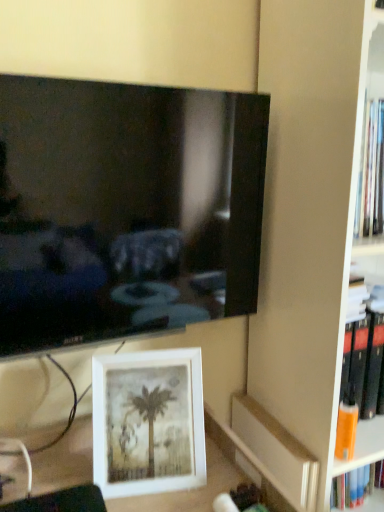
Where is `matte black bookshelf at right`? This screenshot has height=512, width=384. matte black bookshelf at right is located at coordinates (308, 213).

Describe the element at coordinates (125, 209) in the screenshot. I see `black glossy tv at upper left` at that location.

Image resolution: width=384 pixels, height=512 pixels. What are the coordinates of `white matte picture frame at lower center` in the screenshot? It's located at (148, 422).

What do you see at coordinates (277, 451) in the screenshot? I see `orange matte paperback book at lower right` at bounding box center [277, 451].

I want to click on matte black bookshelf at right, so click(x=308, y=213).

Which is correct: black glossy tv at upper left is inside white matte picture frame at lower center, or outside of it?

black glossy tv at upper left cannot be found inside white matte picture frame at lower center.

Locate an element on the screen. picture frame directly beneath the black glossy tv at upper left (from a real-world perspective) is located at coordinates (148, 422).

Based on the photo, considering their positions, is black glossy tv at upper left located in front of or behind white matte picture frame at lower center?

black glossy tv at upper left is positioned closer to the viewer than white matte picture frame at lower center.

In the scene shown: Is black glossy tv at upper left turned away from white matte picture frame at lower center?

black glossy tv at upper left is not turned away from white matte picture frame at lower center.

Choose the correct answer: Is white matte picture frame at lower center inside black glossy tv at upper left or outside it?

white matte picture frame at lower center exists outside the volume of black glossy tv at upper left.

Does white matte picture frame at lower center turn towards black glossy tv at upper left?

No, white matte picture frame at lower center is not turned towards black glossy tv at upper left.

Does white matte picture frame at lower center come in front of black glossy tv at upper left?

No, white matte picture frame at lower center is further to the viewer.

Is white matte picture frame at lower center in contact with black glossy tv at upper left?

No, white matte picture frame at lower center is not touching black glossy tv at upper left.

Is orange matte paperback book at lower right inside or outside of matte black bookshelf at right?

orange matte paperback book at lower right fits inside matte black bookshelf at right.

The width and height of the screenshot is (384, 512). I want to click on paperback book located behind the matte black bookshelf at right, so click(x=277, y=451).

Does orange matte paperback book at lower right turn towards matte black bookshelf at right?

No, orange matte paperback book at lower right is not oriented towards matte black bookshelf at right.

Considering the sizes of objects orange matte paperback book at lower right and matte black bookshelf at right in the image provided, who is wider, orange matte paperback book at lower right or matte black bookshelf at right?

orange matte paperback book at lower right.

Can you confirm if orange matte paperback book at lower right is smaller than black glossy tv at upper left?

Yes.

Is orange matte paperback book at lower right taller or shorter than black glossy tv at upper left?

Considering their sizes, orange matte paperback book at lower right has less height than black glossy tv at upper left.

Could you tell me if orange matte paperback book at lower right is facing black glossy tv at upper left?

No, orange matte paperback book at lower right does not turn towards black glossy tv at upper left.

Is point (272, 469) farther from viewer compared to point (29, 335)?

Yes, point (272, 469) is farther from viewer.

Is white matte picture frame at lower center situated inside orange matte paperback book at lower right or outside?

white matte picture frame at lower center is outside orange matte paperback book at lower right.

Visually, is white matte picture frame at lower center positioned to the left or to the right of orange matte paperback book at lower right?

white matte picture frame at lower center is to the left of orange matte paperback book at lower right.

From a real-world perspective, who is located lower, white matte picture frame at lower center or orange matte paperback book at lower right?

In real-world perspective, orange matte paperback book at lower right is lower.

Find the location of a particular element. picture frame above the orange matte paperback book at lower right (from a real-world perspective) is located at coordinates (148, 422).

Based on the photo, is black glossy tv at upper left directly adjacent to orange matte paperback book at lower right?

No, black glossy tv at upper left is not beside orange matte paperback book at lower right.

Between black glossy tv at upper left and orange matte paperback book at lower right, which one appears on the right side from the viewer's perspective?

orange matte paperback book at lower right is more to the right.

Can you confirm if black glossy tv at upper left is smaller than orange matte paperback book at lower right?

No.

From a real-world perspective, is white matte picture frame at lower center located beneath matte black bookshelf at right?

Yes.

Can you confirm if white matte picture frame at lower center is thinner than matte black bookshelf at right?

Yes.

From the picture: How different are the orientations of white matte picture frame at lower center and matte black bookshelf at right in degrees?

white matte picture frame at lower center and matte black bookshelf at right are facing 15.2 degrees away from each other.

You are a GUI agent. You are given a task and a screenshot of the screen. Output one action in this format:
    pyautogui.click(x=<x>, y=<y>)
    Task: Click on the picture frame below the matte black bookshelf at right (from a real-world perspective)
    This screenshot has height=512, width=384.
    Given the screenshot: What is the action you would take?
    pyautogui.click(x=148, y=422)

This screenshot has height=512, width=384. What are the coordinates of `picture frame directly beneath the black glossy tv at upper left (from a real-world perspective)` in the screenshot? It's located at (x=148, y=422).

Image resolution: width=384 pixels, height=512 pixels. Identify the location of picture frame on the right of black glossy tv at upper left. (148, 422).

From the image, which object appears to be farther from orange matte paperback book at lower right, matte black bookshelf at right or white matte picture frame at lower center?

The object further to orange matte paperback book at lower right is white matte picture frame at lower center.

Estimate the real-world distances between objects in this image. Which object is closer to matte black bookshelf at right, white matte picture frame at lower center or orange matte paperback book at lower right?

Among the two, orange matte paperback book at lower right is located nearer to matte black bookshelf at right.

Looking at the image, which one is located closer to white matte picture frame at lower center, black glossy tv at upper left or matte black bookshelf at right?

The object closer to white matte picture frame at lower center is black glossy tv at upper left.

Which object lies further to the anchor point white matte picture frame at lower center, matte black bookshelf at right or orange matte paperback book at lower right?

matte black bookshelf at right lies further to white matte picture frame at lower center than the other object.

When comparing their distances from matte black bookshelf at right, does white matte picture frame at lower center or black glossy tv at upper left seem further?

Based on the image, white matte picture frame at lower center appears to be further to matte black bookshelf at right.

When comparing their distances from white matte picture frame at lower center, does black glossy tv at upper left or orange matte paperback book at lower right seem closer?

Among the two, black glossy tv at upper left is located nearer to white matte picture frame at lower center.

Looking at the image, which one is located closer to black glossy tv at upper left, orange matte paperback book at lower right or matte black bookshelf at right?

matte black bookshelf at right.

When comparing their distances from black glossy tv at upper left, does white matte picture frame at lower center or matte black bookshelf at right seem closer?

The object closer to black glossy tv at upper left is white matte picture frame at lower center.

Locate an element on the screen. This screenshot has width=384, height=512. picture frame between black glossy tv at upper left and matte black bookshelf at right is located at coordinates (148, 422).

You are a GUI agent. You are given a task and a screenshot of the screen. Output one action in this format:
    pyautogui.click(x=<x>, y=<y>)
    Task: Click on the paperback book between black glossy tv at upper left and matte black bookshelf at right
    Image resolution: width=384 pixels, height=512 pixels.
    Given the screenshot: What is the action you would take?
    pyautogui.click(x=277, y=451)

At what (x,y) coordinates should I click in order to perform the action: click on paperback book located between white matte picture frame at lower center and matte black bookshelf at right in the left-right direction. Please return your answer as a coordinate pair (x, y). Looking at the image, I should click on (277, 451).

Where is `picture frame that lies between black glossy tv at upper left and orange matte paperback book at lower right from top to bottom`? This screenshot has width=384, height=512. picture frame that lies between black glossy tv at upper left and orange matte paperback book at lower right from top to bottom is located at coordinates (148, 422).